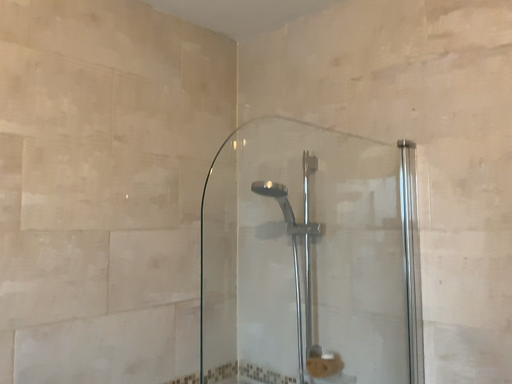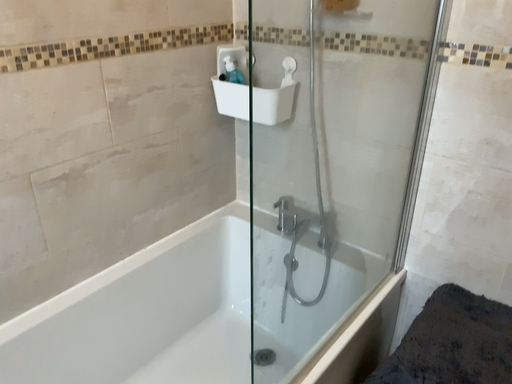
Question: Which way did the camera rotate in the video?

Choices:
 (A) rotated upward
 (B) rotated downward

Answer: (B)